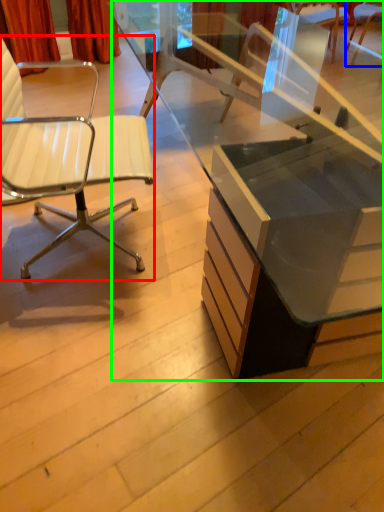
Question: Estimate the real-world distances between objects in this image. Which object is closer to chair (highlighted by a red box), chair (highlighted by a blue box) or desk (highlighted by a green box)?

Choices:
 (A) chair
 (B) desk

Answer: (B)